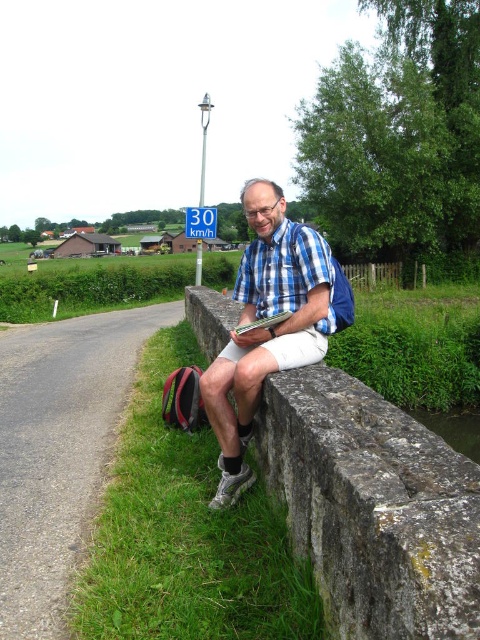
Can you confirm if blue plaid shirt at center is taller than blue checkered shirt at center?

Yes, blue plaid shirt at center is taller than blue checkered shirt at center.

Who is more forward, (x=222, y=445) or (x=302, y=243)?

Positioned in front is point (x=222, y=445).

Is point (288, 257) closer to viewer compared to point (275, 243)?

Yes.

Where is `blue plaid shirt at center`? blue plaid shirt at center is located at coordinates (266, 328).

Is blue plaid shirt at center in front of blue plastic speed limit sign at upper center?

Yes, it is.

Consider the image. Can you confirm if blue plaid shirt at center is positioned above blue plastic speed limit sign at upper center?

No.

Describe the element at coordinates (266, 328) in the screenshot. I see `blue plaid shirt at center` at that location.

The width and height of the screenshot is (480, 640). I want to click on blue plaid shirt at center, so click(266, 328).

Who is more distant from viewer, [384,618] or [202,212]?

The point [202,212] is behind.

Can you confirm if stone at center is positioned below blue plastic speed limit sign at upper center?

Yes, stone at center is below blue plastic speed limit sign at upper center.

This screenshot has width=480, height=640. Describe the element at coordinates (372, 508) in the screenshot. I see `stone at center` at that location.

Locate an element on the screen. Image resolution: width=480 pixels, height=640 pixels. stone at center is located at coordinates (372, 508).